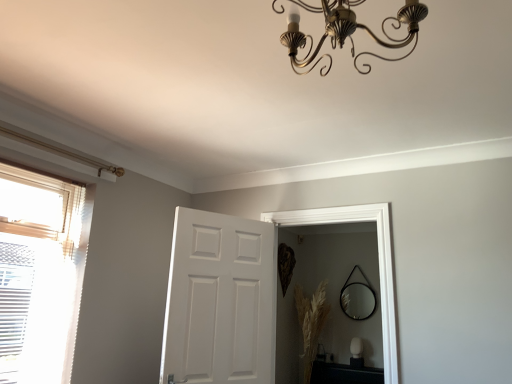
Question: Does white matte door at center come in front of black glossy table at lower right?

Choices:
 (A) no
 (B) yes

Answer: (B)

Question: Is white matte door at center next to black glossy table at lower right and touching it?

Choices:
 (A) yes
 (B) no

Answer: (B)

Question: From the image's perspective, is white matte door at center located beneath black glossy table at lower right?

Choices:
 (A) no
 (B) yes

Answer: (A)

Question: Can you confirm if white matte door at center is thinner than black glossy table at lower right?

Choices:
 (A) yes
 (B) no

Answer: (A)

Question: From a real-world perspective, does white matte door at center sit lower than black glossy table at lower right?

Choices:
 (A) no
 (B) yes

Answer: (A)

Question: Does point (410, 16) appear closer or farther from the camera than point (33, 173)?

Choices:
 (A) farther
 (B) closer

Answer: (B)

Question: Is gold metallic chandelier at upper center bigger or smaller than translucent fabric window at left?

Choices:
 (A) small
 (B) big

Answer: (B)

Question: From a real-world perspective, relative to translucent fabric window at left, is gold metallic chandelier at upper center vertically above or below?

Choices:
 (A) below
 (B) above

Answer: (B)

Question: From the image's perspective, is gold metallic chandelier at upper center located above or below translucent fabric window at left?

Choices:
 (A) below
 (B) above

Answer: (B)

Question: From their relative heights in the image, would you say dry grass at lower right is taller or shorter than black glass mirror at center?

Choices:
 (A) tall
 (B) short

Answer: (A)

Question: From a real-world perspective, relative to black glass mirror at center, is dry grass at lower right vertically above or below?

Choices:
 (A) below
 (B) above

Answer: (A)

Question: Is dry grass at lower right bigger or smaller than black glass mirror at center?

Choices:
 (A) big
 (B) small

Answer: (A)

Question: Is point (312, 314) closer or farther from the camera than point (373, 291)?

Choices:
 (A) farther
 (B) closer

Answer: (B)

Question: Is point 358,367 positioned closer to the camera than point 412,11?

Choices:
 (A) farther
 (B) closer

Answer: (A)

Question: From a real-world perspective, is black glossy table at lower right physically located above or below gold metallic chandelier at upper center?

Choices:
 (A) below
 (B) above

Answer: (A)